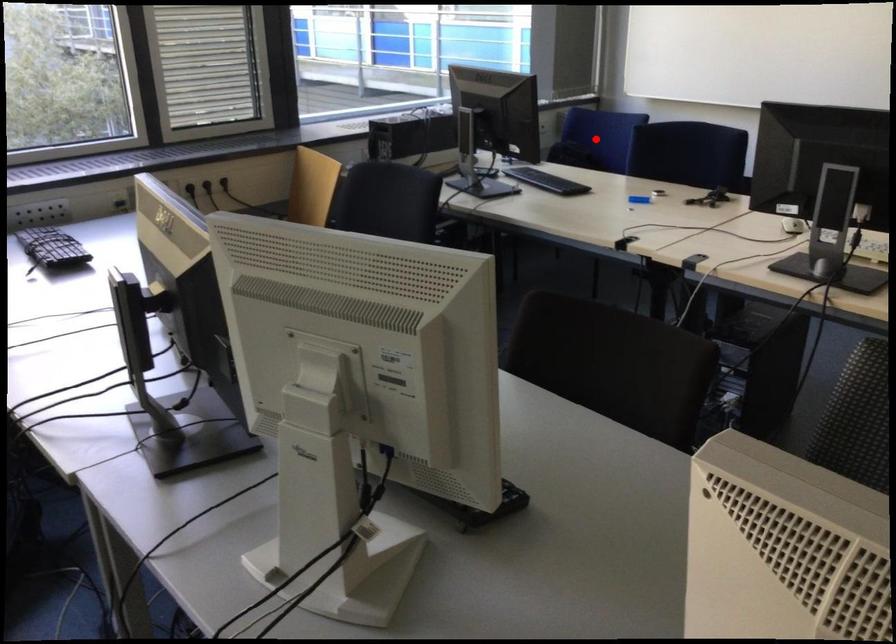
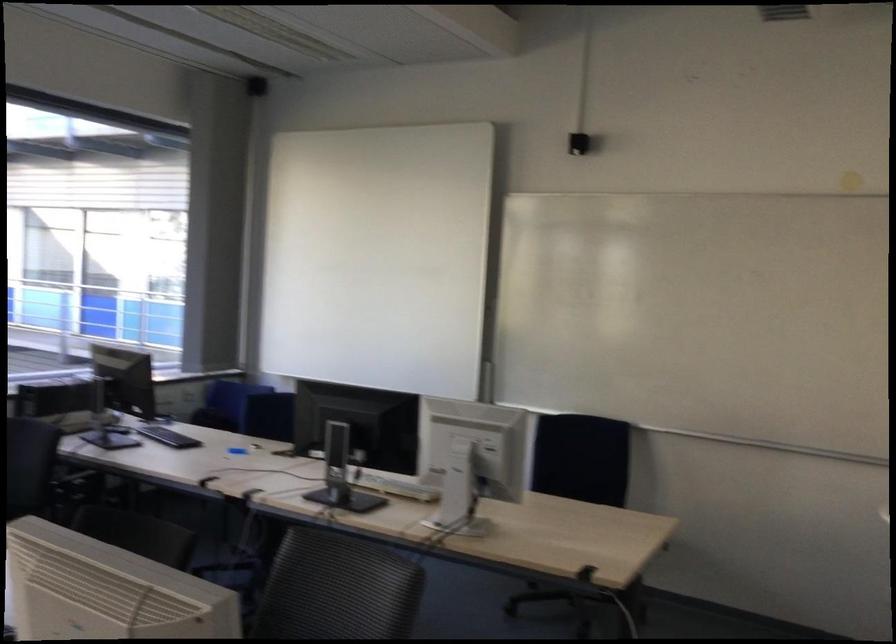
Question: I am providing you with two images of the same scene from different viewpoints. A red point is marked on the first image. Is the red point's position out of view in image 2?

Choices:
 (A) Yes
 (B) No

Answer: (A)